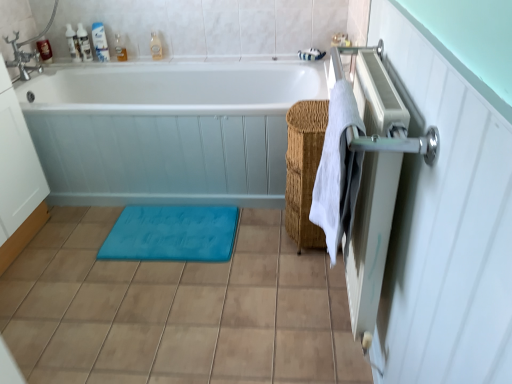
Describe the element at coordinates (177, 310) in the screenshot. I see `brown matte tile at lower center` at that location.

How much space does white glossy bottle at upper left, positioned as the 4th toiletry in right-to-left order, occupy horizontally?

white glossy bottle at upper left, positioned as the 4th toiletry in right-to-left order, is 7.03 centimeters wide.

Where is `white cotton towel at right`? white cotton towel at right is located at coordinates (338, 172).

In order to face white glossy bathtub at center, should I rotate leftwards or rightwards?

You should rotate left by 10.711 degrees.

Image resolution: width=512 pixels, height=384 pixels. Describe the element at coordinates (120, 48) in the screenshot. I see `translucent plastic bottle at upper left, which ranks as the 2th toiletry in right-to-left order` at that location.

Describe the element at coordinates (446, 219) in the screenshot. I see `metallic silver radiator at right` at that location.

I want to click on brown matte tile at lower center, so click(x=177, y=310).

Does translucent plastic soap at upper left, arranged as the 6th toiletry when viewed from the right, have a lesser height compared to translucent plastic bottles at upper left, arranged as the 5th toiletry when viewed from the right?

Yes, translucent plastic soap at upper left, arranged as the 6th toiletry when viewed from the right, is shorter than translucent plastic bottles at upper left, arranged as the 5th toiletry when viewed from the right.

Considering the relative positions of translucent plastic soap at upper left, arranged as the 6th toiletry when viewed from the right, and translucent plastic bottles at upper left, arranged as the 5th toiletry when viewed from the right, in the image provided, is translucent plastic soap at upper left, arranged as the 6th toiletry when viewed from the right, in front of translucent plastic bottles at upper left, arranged as the 5th toiletry when viewed from the right,?

No.

From the image's perspective, which object appears higher, translucent plastic soap at upper left, which is the 1th toiletry from left to right, or translucent plastic bottles at upper left, arranged as the 5th toiletry when viewed from the right?

translucent plastic bottles at upper left, arranged as the 5th toiletry when viewed from the right, is shown above in the image.

From a real-world perspective, between translucent plastic soap at upper left, which is the 1th toiletry from left to right, and translucent plastic bottles at upper left, arranged as the 5th toiletry when viewed from the right, who is vertically lower?

translucent plastic soap at upper left, which is the 1th toiletry from left to right, is physically lower.

Do you think white glossy bathtub at center is within white glossy bottle at upper left, acting as the third toiletry starting from the right, or outside of it?

white glossy bathtub at center is spatially situated outside white glossy bottle at upper left, acting as the third toiletry starting from the right.

Measure the distance from white glossy bathtub at center to white glossy bottle at upper left, the fourth toiletry viewed from the left.

36.09 inches.

Considering the relative positions of white glossy bathtub at center and white glossy bottle at upper left, acting as the third toiletry starting from the right, in the image provided, is white glossy bathtub at center to the left or to the right of white glossy bottle at upper left, acting as the third toiletry starting from the right,?

white glossy bathtub at center is to the right of white glossy bottle at upper left, acting as the third toiletry starting from the right.

Considering the relative sizes of white glossy bathtub at center and white glossy bottle at upper left, acting as the third toiletry starting from the right, in the image provided, is white glossy bathtub at center shorter than white glossy bottle at upper left, acting as the third toiletry starting from the right,?

Incorrect, the height of white glossy bathtub at center does not fall short of that of white glossy bottle at upper left, acting as the third toiletry starting from the right.

Who is taller, translucent plastic bottle at upper left, which ranks as the 2th toiletry in right-to-left order, or white glossy bathtub at center?

With more height is white glossy bathtub at center.

Is translucent plastic bottle at upper left, which ranks as the 2th toiletry in right-to-left order, oriented towards white glossy bathtub at center?

No, translucent plastic bottle at upper left, which ranks as the 2th toiletry in right-to-left order, does not turn towards white glossy bathtub at center.

Does translucent plastic bottle at upper left, which ranks as the 2th toiletry in right-to-left order, lie behind white glossy bathtub at center?

Yes, the depth of translucent plastic bottle at upper left, which ranks as the 2th toiletry in right-to-left order, is greater than that of white glossy bathtub at center.

Consider the image. How different are the orientations of translucent plastic bottle at upper left, which ranks as the 2th toiletry in right-to-left order, and white glossy bathtub at center in degrees?

The facing directions of translucent plastic bottle at upper left, which ranks as the 2th toiletry in right-to-left order, and white glossy bathtub at center are 6.84e-05 degrees apart.

Who is smaller, white glossy bathtub at center or translucent plastic bottle at upper left, which ranks as the 2th toiletry in right-to-left order?

translucent plastic bottle at upper left, which ranks as the 2th toiletry in right-to-left order.

From a real-world perspective, between white glossy bathtub at center and translucent plastic bottle at upper left, which ranks as the 2th toiletry in right-to-left order, who is vertically lower?

In real-world perspective, white glossy bathtub at center is lower.

Is white glossy bathtub at center wider or thinner than translucent plastic bottle at upper left, which ranks as the 2th toiletry in right-to-left order?

white glossy bathtub at center is wider than translucent plastic bottle at upper left, which ranks as the 2th toiletry in right-to-left order.

Measure the distance between white glossy bathtub at center and translucent plastic bottle at upper left, acting as the fifth toiletry starting from the left.

white glossy bathtub at center and translucent plastic bottle at upper left, acting as the fifth toiletry starting from the left, are 90.37 centimeters apart from each other.

Which object is thinner, white glossy bottle at upper left, acting as the third toiletry starting from the right, or translucent plastic bottles at upper left, the second toiletry viewed from the left?

With smaller width is white glossy bottle at upper left, acting as the third toiletry starting from the right.

From the image's perspective, is white glossy bottle at upper left, the fourth toiletry viewed from the left, on top of translucent plastic bottles at upper left, arranged as the 5th toiletry when viewed from the right?

Indeed, from the image's perspective, white glossy bottle at upper left, the fourth toiletry viewed from the left, is shown above translucent plastic bottles at upper left, arranged as the 5th toiletry when viewed from the right.

Which of these two, white glossy bottle at upper left, the fourth toiletry viewed from the left, or translucent plastic bottles at upper left, arranged as the 5th toiletry when viewed from the right, is bigger?

translucent plastic bottles at upper left, arranged as the 5th toiletry when viewed from the right, is bigger.

Is white glossy bottle at upper left, acting as the third toiletry starting from the right, not within translucent plastic bottles at upper left, the second toiletry viewed from the left?

Indeed, white glossy bottle at upper left, acting as the third toiletry starting from the right, is completely outside translucent plastic bottles at upper left, the second toiletry viewed from the left.

Is woven brown basket at center-right wider than translucent plastic bottle at upper left, acting as the fifth toiletry starting from the left?

Yes, woven brown basket at center-right is wider than translucent plastic bottle at upper left, acting as the fifth toiletry starting from the left.

Between point (301, 190) and point (118, 45), which one is positioned behind?

The point (118, 45) is farther.

Can you tell me how much woven brown basket at center-right and translucent plastic bottle at upper left, acting as the fifth toiletry starting from the left, differ in facing direction?

There is a 90-degree angle between the facing directions of woven brown basket at center-right and translucent plastic bottle at upper left, acting as the fifth toiletry starting from the left.

Is woven brown basket at center-right shorter than translucent plastic bottle at upper left, acting as the fifth toiletry starting from the left?

Incorrect, the height of woven brown basket at center-right does not fall short of that of translucent plastic bottle at upper left, acting as the fifth toiletry starting from the left.

Would you say translucent plastic soap at upper left, arranged as the 6th toiletry when viewed from the right, is inside or outside blue rubber bath mat at center?

The correct answer is: outside.

Can you tell me how much translucent plastic soap at upper left, which is the 1th toiletry from left to right, and blue rubber bath mat at center differ in facing direction?

The angle between the facing direction of translucent plastic soap at upper left, which is the 1th toiletry from left to right, and the facing direction of blue rubber bath mat at center is 72.6 degrees.

Could you tell me if translucent plastic soap at upper left, arranged as the 6th toiletry when viewed from the right, is turned towards blue rubber bath mat at center?

No, translucent plastic soap at upper left, arranged as the 6th toiletry when viewed from the right, is not facing towards blue rubber bath mat at center.

From a real-world perspective, does translucent plastic soap at upper left, which is the 1th toiletry from left to right, stand above blue rubber bath mat at center?

Correct, in the physical world, translucent plastic soap at upper left, which is the 1th toiletry from left to right, is higher than blue rubber bath mat at center.

The image size is (512, 384). There is a translucent plastic bottles at upper left, arranged as the 5th toiletry when viewed from the right. Find the location of `the 3rd toiletry below it (from a real-world perspective)`. the 3rd toiletry below it (from a real-world perspective) is located at coordinates (44, 50).

Identify the location of toiletry that is the 1st one when counting backward from the white glossy bathtub at center. The height and width of the screenshot is (384, 512). (100, 42).

Consider the image. Based on their spatial positions, is blue rubber bath mat at center or translucent plastic soap at upper left, arranged as the 6th toiletry when viewed from the right, closer to brown matte tile at lower center?

The object closer to brown matte tile at lower center is blue rubber bath mat at center.

In the scene shown: Looking at the image, which one is located further to white glossy bathtub at center, translucent plastic soap at upper left, arranged as the 6th toiletry when viewed from the right, or translucent plastic bottle at upper center, arranged as the first toiletry when viewed from the right?

translucent plastic soap at upper left, arranged as the 6th toiletry when viewed from the right.

From the image, which object appears to be farther from white glossy bathtub at center, brown matte tile at lower center or translucent plastic bottle at upper left, which ranks as the 2th toiletry in right-to-left order?

translucent plastic bottle at upper left, which ranks as the 2th toiletry in right-to-left order, is further to white glossy bathtub at center.

From the image, which object appears to be nearer to translucent plastic bottles at upper left, the second toiletry viewed from the left, white cotton towel at right or white glossy bottle at upper left, arranged as the 3th toiletry when viewed from the left?

white glossy bottle at upper left, arranged as the 3th toiletry when viewed from the left, is closer to translucent plastic bottles at upper left, the second toiletry viewed from the left.

Estimate the real-world distances between objects in this image. Which object is closer to white glossy bottle at upper left, the fourth toiletry viewed from the left, brown matte tile at lower center or white glossy bottle at upper left, positioned as the 4th toiletry in right-to-left order?

The object closer to white glossy bottle at upper left, the fourth toiletry viewed from the left, is white glossy bottle at upper left, positioned as the 4th toiletry in right-to-left order.

From the image, which object appears to be nearer to brown matte tile at lower center, translucent plastic bottles at upper left, arranged as the 5th toiletry when viewed from the right, or woven brown basket at center-right?

woven brown basket at center-right.

Estimate the real-world distances between objects in this image. Which object is further from white glossy bottle at upper left, acting as the third toiletry starting from the right, white glossy bathtub at center or translucent plastic bottle at upper center, arranged as the first toiletry when viewed from the right?

white glossy bathtub at center lies further to white glossy bottle at upper left, acting as the third toiletry starting from the right, than the other object.

From the image, which object appears to be nearer to white glossy bathtub at center, white cotton towel at right or blue rubber bath mat at center?

Among the two, blue rubber bath mat at center is located nearer to white glossy bathtub at center.

Locate an element on the screen. This screenshot has height=384, width=512. bath mat between white glossy bottle at upper left, acting as the third toiletry starting from the right, and brown matte tile at lower center in the up-down direction is located at coordinates (172, 233).

Locate an element on the screen. The height and width of the screenshot is (384, 512). ceramic tile located between metallic silver radiator at right and white glossy bottle at upper left, the fourth toiletry viewed from the left, in the depth direction is located at coordinates (177, 310).

Identify the location of ceramic tile located between white cotton towel at right and translucent plastic bottle at upper center, arranged as the first toiletry when viewed from the right, in the depth direction. (177, 310).

You are a GUI agent. You are given a task and a screenshot of the screen. Output one action in this format:
    pyautogui.click(x=<x>, y=<y>)
    Task: Click on the bathtub between white glossy bottle at upper left, positioned as the 4th toiletry in right-to-left order, and brown matte tile at lower center vertically
    
    Given the screenshot: What is the action you would take?
    pyautogui.click(x=166, y=130)